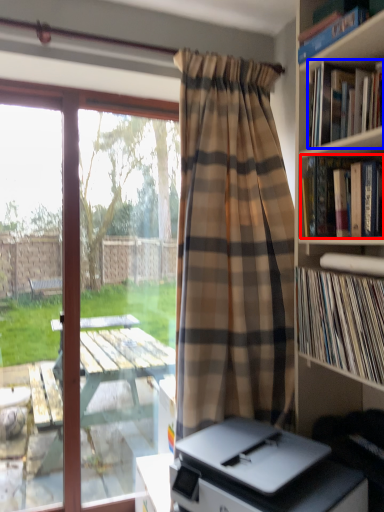
Question: Among these objects, which one is nearest to the camera, book (highlighted by a red box) or book (highlighted by a blue box)?

Choices:
 (A) book
 (B) book

Answer: (B)